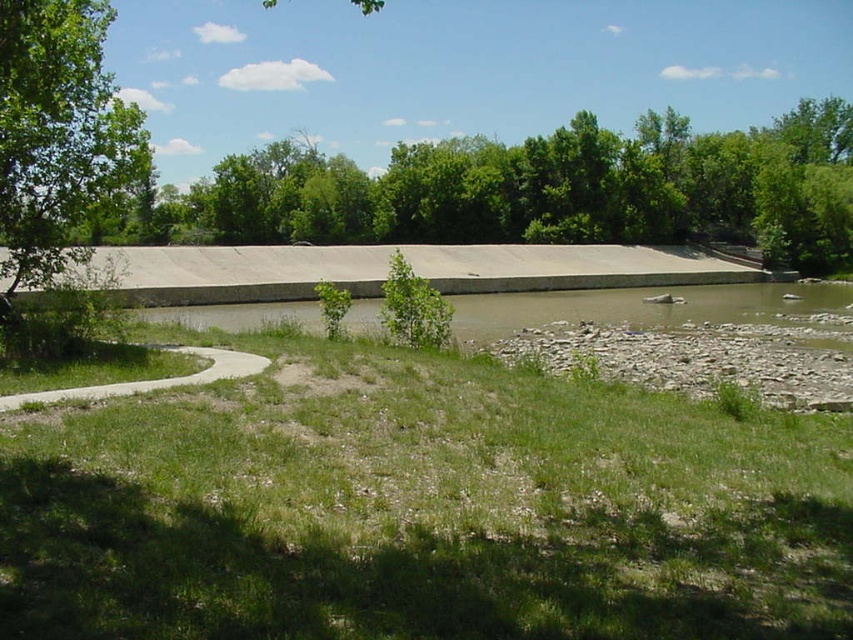
Question: Which of the following is the farthest from the observer?

Choices:
 (A) green grass at lower center
 (B) concrete at left
 (C) green leafy tree at upper left

Answer: (B)

Question: Can you confirm if green grass at lower center is positioned below concrete at left?

Choices:
 (A) no
 (B) yes

Answer: (B)

Question: Among these objects, which one is nearest to the camera?

Choices:
 (A) green grass at lower center
 (B) green leafy tree at upper left
 (C) concrete at left

Answer: (A)

Question: Which point appears farthest from the camera in this image?

Choices:
 (A) (59, 401)
 (B) (74, 225)
 (C) (64, 458)

Answer: (B)

Question: Is green leafy tree at upper left to the right of concrete at left from the viewer's perspective?

Choices:
 (A) no
 (B) yes

Answer: (A)

Question: Does green grass at lower center lie behind concrete at left?

Choices:
 (A) no
 (B) yes

Answer: (A)